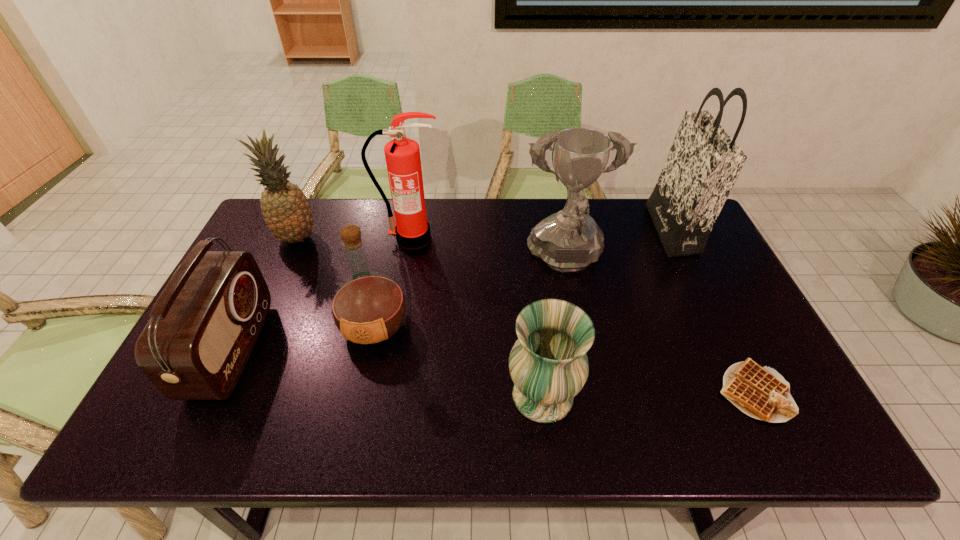
Image resolution: width=960 pixels, height=540 pixels. I want to click on free spot between the award and the shopping bag, so click(618, 245).

Find the location of a particular element. The width and height of the screenshot is (960, 540). vacant space that's between the vase and the liquor is located at coordinates (459, 361).

This screenshot has height=540, width=960. I want to click on unoccupied position between the award and the fire extinguisher, so click(489, 249).

I want to click on object that ranks as the fifth closest to the fire extinguisher, so [548, 364].

This screenshot has width=960, height=540. I want to click on object that can be found as the fourth closest to the pineapple, so point(570,240).

Image resolution: width=960 pixels, height=540 pixels. I want to click on free space in the image that satisfies the following two spatial constraints: 1. on the front of the shopping bag with the design; 2. on the side with emblem of the award, so click(x=686, y=260).

At what (x,y) coordinates should I click in order to perform the action: click on vacant space that satisfies the following two spatial constraints: 1. on the front of the shopping bag with the design; 2. with the nozzle aimed from the fire extinguisher. Please return your answer as a coordinate pair (x, y). The width and height of the screenshot is (960, 540). Looking at the image, I should click on (676, 238).

Locate an element on the screen. Image resolution: width=960 pixels, height=540 pixels. vacant space that satisfies the following two spatial constraints: 1. on the side with emblem of the award; 2. on the right side of the waffle is located at coordinates 592,392.